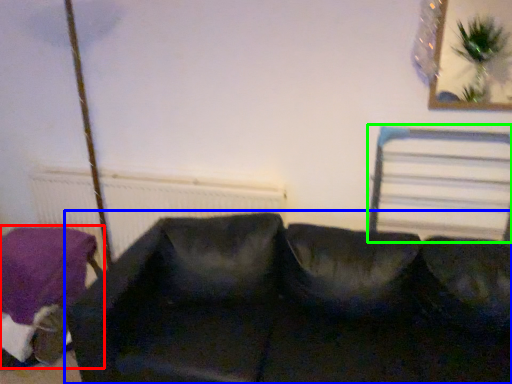
Question: Estimate the real-world distances between objects in this image. Which object is farther from furniture (highlighted by a red box), studio couch (highlighted by a blue box) or bed frame (highlighted by a green box)?

Choices:
 (A) studio couch
 (B) bed frame

Answer: (B)